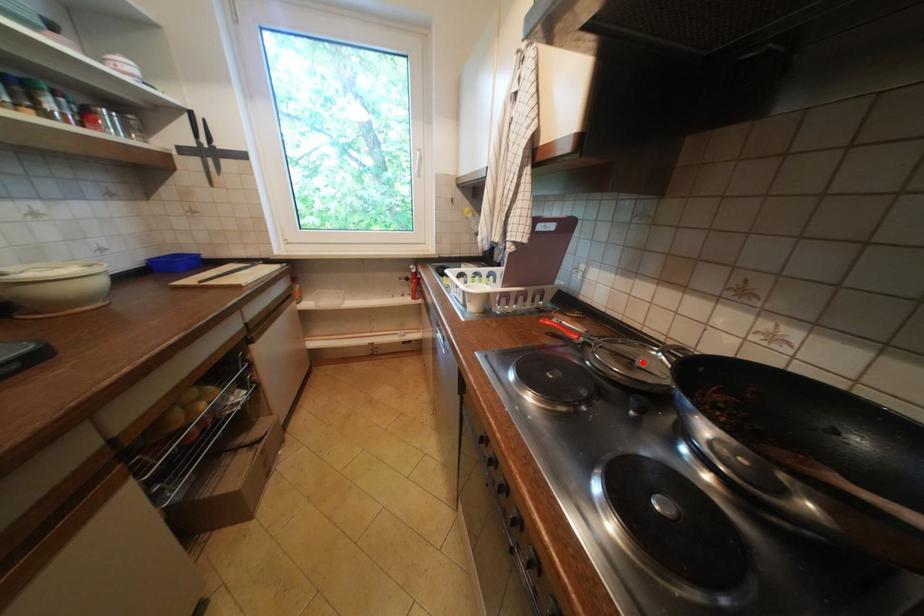
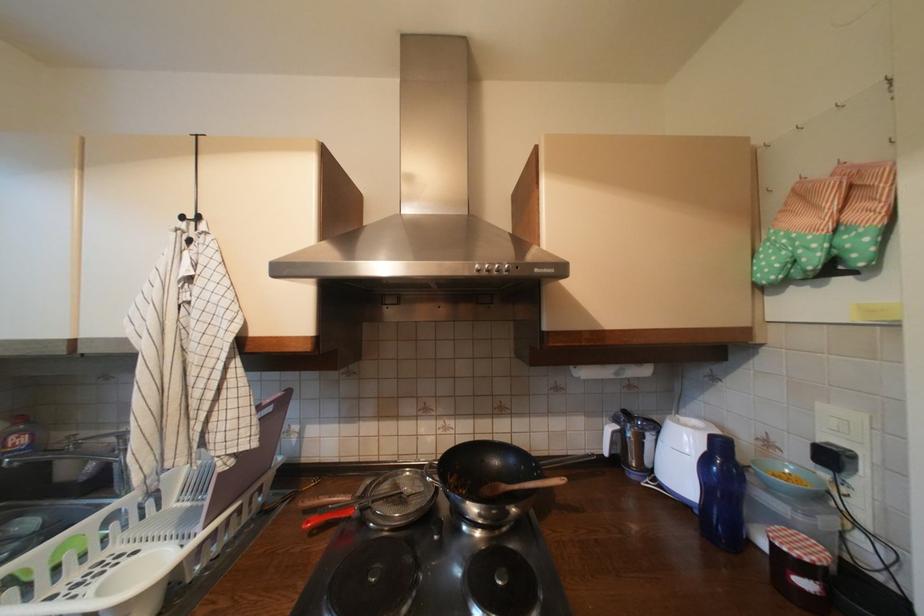
The point at the highlighted location is marked in the first image. Where is the corresponding point in the second image?

(410, 495)